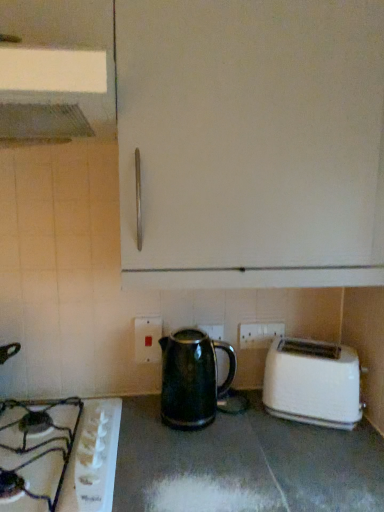
In order to click on free location in front of green glossy kettle at center in this screenshot , I will do `click(196, 457)`.